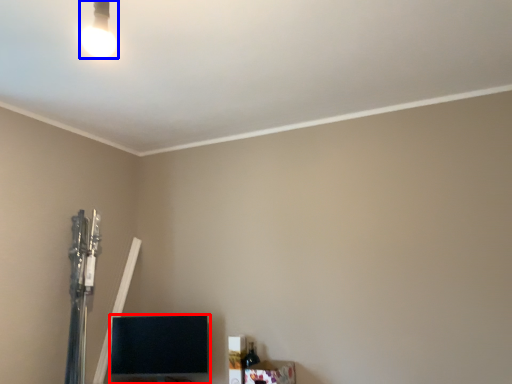
Question: Which object appears closest to the camera in this image, furniture (highlighted by a red box) or lamp (highlighted by a blue box)?

Choices:
 (A) furniture
 (B) lamp

Answer: (B)